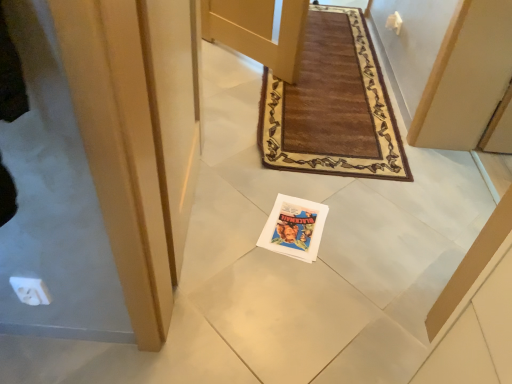
You are a GUI agent. You are given a task and a screenshot of the screen. Output one action in this format:
    pyautogui.click(x=<x>, y=<y>)
    Task: Click on the matte paper magazine at center
    
    Given the screenshot: What is the action you would take?
    pyautogui.click(x=294, y=228)

The image size is (512, 384). What do you see at coordinates (294, 228) in the screenshot?
I see `matte paper magazine at center` at bounding box center [294, 228].

Image resolution: width=512 pixels, height=384 pixels. Describe the element at coordinates (466, 77) in the screenshot. I see `matte wood door at center` at that location.

Where is `matte wood door at center`? The width and height of the screenshot is (512, 384). matte wood door at center is located at coordinates (466, 77).

Image resolution: width=512 pixels, height=384 pixels. I want to click on matte paper magazine at center, so click(294, 228).

Based on the photo, between matte wood door at center and matte paper magazine at center, which one appears on the right side from the viewer's perspective?

From the viewer's perspective, matte wood door at center appears more on the right side.

Who is more distant, matte wood door at center or matte paper magazine at center?

matte paper magazine at center is further away from the camera.

Is point (439, 126) positioned before point (308, 211)?

No, (439, 126) is behind (308, 211).

From the image's perspective, is matte wood door at center above or below matte paper magazine at center?

matte wood door at center is above matte paper magazine at center.

From a real-world perspective, which object stands above the other?

From a 3D spatial view, matte wood door at center is above.

Is matte wood door at center wider or thinner than matte paper magazine at center?

Considering their sizes, matte wood door at center looks broader than matte paper magazine at center.

Considering the relative sizes of matte wood door at center and matte paper magazine at center in the image provided, is matte wood door at center shorter than matte paper magazine at center?

No.

Considering the relative sizes of matte wood door at center and matte paper magazine at center in the image provided, is matte wood door at center smaller than matte paper magazine at center?

No.

Is matte wood door at center completely or partially outside of matte paper magazine at center?

Yes, matte wood door at center is not within matte paper magazine at center.

Is matte wood door at center not close to matte paper magazine at center?

No, there isn't a large distance between matte wood door at center and matte paper magazine at center.

Is matte wood door at center aimed at matte paper magazine at center?

Yes, matte wood door at center is turned towards matte paper magazine at center.

Measure the distance between matte wood door at center and matte paper magazine at center.

matte wood door at center and matte paper magazine at center are 32.76 inches apart from each other.

At what (x,y) coordinates should I click in order to perform the action: click on magazine below the matte wood door at center (from the image's perspective). Please return your answer as a coordinate pair (x, y). Looking at the image, I should click on (294, 228).

Is matte paper magazine at center at the right side of matte wood door at center?

No, matte paper magazine at center is not to the right of matte wood door at center.

In the image, is matte paper magazine at center positioned in front of or behind matte wood door at center?

matte paper magazine at center is positioned farther from the viewer than matte wood door at center.

Which point is more distant from viewer, (319, 218) or (457, 97)?

The point (457, 97) is farther.

From the image's perspective, is matte paper magazine at center beneath matte wood door at center?

Correct, matte paper magazine at center appears lower than matte wood door at center in the image.

From a real-world perspective, is matte paper magazine at center located higher than matte wood door at center?

No, from a real-world perspective, matte paper magazine at center is not above matte wood door at center.

Does matte paper magazine at center have a greater width compared to matte wood door at center?

In fact, matte paper magazine at center might be narrower than matte wood door at center.

Which of these two, matte paper magazine at center or matte wood door at center, stands taller?

With more height is matte wood door at center.

Looking at the image, does matte paper magazine at center seem bigger or smaller compared to matte wood door at center?

Clearly, matte paper magazine at center is smaller in size than matte wood door at center.

Choose the correct answer: Is matte paper magazine at center inside matte wood door at center or outside it?

matte paper magazine at center exists outside the volume of matte wood door at center.

Are matte paper magazine at center and matte wood door at center far apart?

Actually, matte paper magazine at center and matte wood door at center are a little close together.

From the picture: Could you tell me if matte paper magazine at center is facing matte wood door at center?

No, matte paper magazine at center is not facing towards matte wood door at center.

This screenshot has height=384, width=512. Identify the location of magazine located behind the matte wood door at center. (294, 228).

Identify the location of door above the matte paper magazine at center (from a real-world perspective). Image resolution: width=512 pixels, height=384 pixels. (466, 77).

Where is `door in front of the matte paper magazine at center`? This screenshot has width=512, height=384. door in front of the matte paper magazine at center is located at coordinates (466, 77).